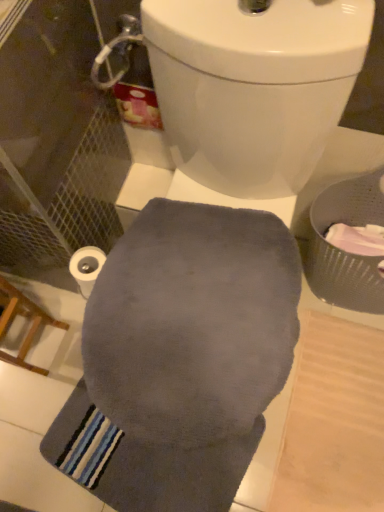
Question: Considering the relative sizes of gray soft towel at center and gray woven basket at right in the image provided, is gray soft towel at center shorter than gray woven basket at right?

Choices:
 (A) no
 (B) yes

Answer: (B)

Question: Is gray soft towel at center with gray woven basket at right?

Choices:
 (A) no
 (B) yes

Answer: (A)

Question: Can gray woven basket at right be found inside gray soft towel at center?

Choices:
 (A) no
 (B) yes

Answer: (A)

Question: Can you confirm if gray soft towel at center is taller than gray woven basket at right?

Choices:
 (A) yes
 (B) no

Answer: (B)

Question: Does gray soft towel at center appear on the right side of gray woven basket at right?

Choices:
 (A) yes
 (B) no

Answer: (B)

Question: Is white matte toilet paper at lower left taller or shorter than wooden chair at lower left?

Choices:
 (A) short
 (B) tall

Answer: (A)

Question: Is white matte toilet paper at lower left bigger or smaller than wooden chair at lower left?

Choices:
 (A) small
 (B) big

Answer: (A)

Question: Based on their positions, is white matte toilet paper at lower left located to the left or right of wooden chair at lower left?

Choices:
 (A) right
 (B) left

Answer: (A)

Question: Considering their positions, is white matte toilet paper at lower left located in front of or behind wooden chair at lower left?

Choices:
 (A) front
 (B) behind

Answer: (B)

Question: Considering the positions of gray soft towel at center and white matte toilet paper at lower left in the image, is gray soft towel at center taller or shorter than white matte toilet paper at lower left?

Choices:
 (A) short
 (B) tall

Answer: (A)

Question: Visually, is gray soft towel at center positioned to the left or to the right of white matte toilet paper at lower left?

Choices:
 (A) right
 (B) left

Answer: (A)

Question: Is point (163, 471) positioned closer to the camera than point (87, 276)?

Choices:
 (A) closer
 (B) farther

Answer: (B)

Question: Considering the positions of gray soft towel at center and white matte toilet paper at lower left in the image, is gray soft towel at center wider or thinner than white matte toilet paper at lower left?

Choices:
 (A) wide
 (B) thin

Answer: (A)

Question: In terms of size, does wooden chair at lower left appear bigger or smaller than gray soft towel at center?

Choices:
 (A) big
 (B) small

Answer: (A)

Question: Is point (34, 325) closer or farther from the camera than point (100, 414)?

Choices:
 (A) closer
 (B) farther

Answer: (B)